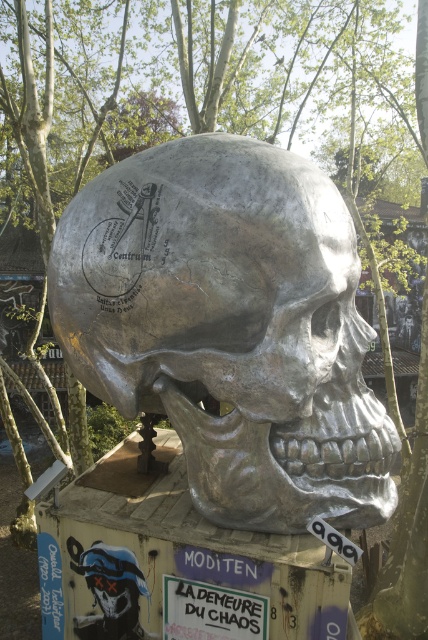
Question: Among these points, which one is farthest from the camera?

Choices:
 (A) (202, 474)
 (B) (124, 595)

Answer: (B)

Question: Does shiny silver skull at center appear on the left side of blue glossy skull at lower left?

Choices:
 (A) yes
 (B) no

Answer: (B)

Question: Does shiny silver skull at center have a smaller size compared to blue glossy skull at lower left?

Choices:
 (A) no
 (B) yes

Answer: (A)

Question: Which of the following is the closest to the observer?

Choices:
 (A) (122, 548)
 (B) (335, 476)

Answer: (B)

Question: Considering the relative positions of shiny silver skull at center and blue glossy skull at lower left in the image provided, where is shiny silver skull at center located with respect to blue glossy skull at lower left?

Choices:
 (A) above
 (B) below

Answer: (A)